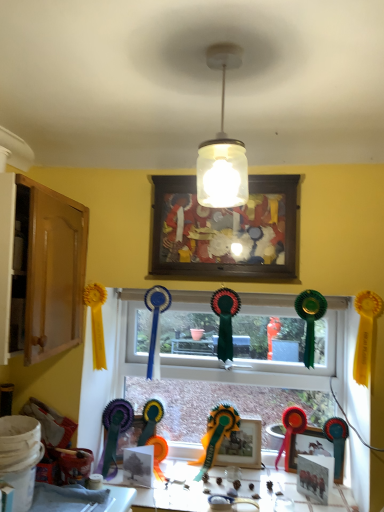
Describe the element at coordinates (242, 445) in the screenshot. I see `wooden photo frame at center, which is the 1th picture frame from back to front` at that location.

Where is `shiny red ribbon at center, which is the 1th toy from right to left`? shiny red ribbon at center, which is the 1th toy from right to left is located at coordinates (291, 430).

What is the approximate width of wooden cabinet at left?

The width of wooden cabinet at left is 15.89 inches.

Locate an element on the screen. The image size is (384, 512). white glossy table at lower center is located at coordinates (173, 490).

What do you see at coordinates (225, 231) in the screenshot? This screenshot has height=512, width=384. I see `wooden picture frame at center, which is the first picture frame from front to back` at bounding box center [225, 231].

What do you see at coordinates (315, 476) in the screenshot?
I see `matte white picture frame at lower center, the fourth picture frame in the top-to-bottom sequence` at bounding box center [315, 476].

How much space does matte white picture frame at lower center, which appears as the 2th picture frame when viewed from the front, occupy vertically?

matte white picture frame at lower center, which appears as the 2th picture frame when viewed from the front, is 6.42 inches tall.

At what (x,y) coordinates should I click in order to perform the action: click on wooden photo frame at center, which is the 1th picture frame from back to front. Please return your answer as a coordinate pair (x, y). Image resolution: width=384 pixels, height=512 pixels. Looking at the image, I should click on (242, 445).

Is translucent glass jar at center positioned far away from wooden photo frame at center, arranged as the second picture frame when viewed from the top?

Yes, translucent glass jar at center is far from wooden photo frame at center, arranged as the second picture frame when viewed from the top.

Can you confirm if translucent glass jar at center is thinner than wooden photo frame at center, arranged as the second picture frame when viewed from the top?

No, translucent glass jar at center is not thinner than wooden photo frame at center, arranged as the second picture frame when viewed from the top.

What's the angular difference between translucent glass jar at center and wooden photo frame at center, which ranks as the 4th picture frame in front-to-back order,'s facing directions?

They differ by 88.9 degrees in their facing directions.

Is translucent glass jar at center at the left side of wooden photo frame at center, which ranks as the 4th picture frame in front-to-back order?

Correct, you'll find translucent glass jar at center to the left of wooden photo frame at center, which ranks as the 4th picture frame in front-to-back order.

In the scene shown: Does wooden cabinet at left contain matte white picture frame at lower center, which appears as the 2th picture frame when viewed from the front?

Definitely not — matte white picture frame at lower center, which appears as the 2th picture frame when viewed from the front, is not inside wooden cabinet at left.

From the image's perspective, who appears lower, wooden cabinet at left or matte white picture frame at lower center, marked as the first picture frame in a bottom-to-top arrangement?

matte white picture frame at lower center, marked as the first picture frame in a bottom-to-top arrangement, appears lower in the image.

There is a matte white picture frame at lower center, which is the third picture frame from back to front. Where is `dresser above it (from a real-world perspective)`? This screenshot has height=512, width=384. dresser above it (from a real-world perspective) is located at coordinates (52, 270).

Is the position of wooden cabinet at left more distant than that of matte white picture frame at lower center, which appears as the 2th picture frame when viewed from the front?

No, wooden cabinet at left is closer to the viewer.

Choose the correct answer: Is translucent glass jar at center inside wooden picture frame at center, marked as the 4th picture frame in a back-to-front arrangement, or outside it?

translucent glass jar at center exists outside the volume of wooden picture frame at center, marked as the 4th picture frame in a back-to-front arrangement.

In terms of width, does translucent glass jar at center look wider or thinner when compared to wooden picture frame at center, marked as the 4th picture frame in a back-to-front arrangement?

translucent glass jar at center is wider than wooden picture frame at center, marked as the 4th picture frame in a back-to-front arrangement.

Based on the photo, is translucent glass jar at center next to wooden picture frame at center, which is the first picture frame from front to back, and touching it?

No, translucent glass jar at center is not making contact with wooden picture frame at center, which is the first picture frame from front to back.

Can you confirm if translucent glass jar at center is taller than wooden picture frame at center, the first picture frame when ordered from top to bottom?

No.

Is the position of glass window at center less distant than that of wooden photo frame at center, which is the 1th picture frame from back to front?

Yes, glass window at center is closer to the viewer.

What are the coordinates of `picture frame that is the 1st one when counting rightward from the glass window at center` in the screenshot? It's located at (242, 445).

Can you tell me how much matte white picture frame at lower center, which is the third picture frame from back to front, and glass window at center differ in facing direction?

matte white picture frame at lower center, which is the third picture frame from back to front, and glass window at center are facing 9.27 degrees away from each other.

Which object is positioned more to the right, matte white picture frame at lower center, which is the third picture frame from back to front, or glass window at center?

matte white picture frame at lower center, which is the third picture frame from back to front.

Is point (312, 456) positioned before point (211, 340)?

Yes, it is.

Considering the positions of point (235, 450) and point (239, 52), is point (235, 450) closer or farther from the camera than point (239, 52)?

Point (235, 450) appears to be farther away from the viewer than point (239, 52).

Is wooden photo frame at center, arranged as the second picture frame when viewed from the top, positioned far away from translucent glass jar at center?

wooden photo frame at center, arranged as the second picture frame when viewed from the top, is far away from translucent glass jar at center.

From the picture: Considering the relative sizes of wooden photo frame at center, which ranks as the 4th picture frame in front-to-back order, and translucent glass jar at center in the image provided, is wooden photo frame at center, which ranks as the 4th picture frame in front-to-back order, shorter than translucent glass jar at center?

Yes, wooden photo frame at center, which ranks as the 4th picture frame in front-to-back order, is shorter than translucent glass jar at center.

Is wooden photo frame at center, which is the 3th picture frame from bottom to top, bigger or smaller than translucent glass jar at center?

Considering their sizes, wooden photo frame at center, which is the 3th picture frame from bottom to top, takes up less space than translucent glass jar at center.

In the image, is wooden photo frame at center, arranged as the second picture frame when viewed from the top, positioned in front of or behind wooden picture frame at center, the 4th picture frame in the bottom-to-top sequence?

wooden photo frame at center, arranged as the second picture frame when viewed from the top, is positioned farther from the viewer than wooden picture frame at center, the 4th picture frame in the bottom-to-top sequence.

Is wooden photo frame at center, arranged as the second picture frame when viewed from the top, spatially inside wooden picture frame at center, the 4th picture frame in the bottom-to-top sequence, or outside of it?

wooden photo frame at center, arranged as the second picture frame when viewed from the top, is not inside wooden picture frame at center, the 4th picture frame in the bottom-to-top sequence, it's outside.

Would you consider wooden photo frame at center, which is the 1th picture frame from back to front, to be distant from wooden picture frame at center, which is the first picture frame from front to back?

Yes, wooden photo frame at center, which is the 1th picture frame from back to front, and wooden picture frame at center, which is the first picture frame from front to back, are quite far apart.

From a real-world perspective, is wooden photo frame at center, which ranks as the 4th picture frame in front-to-back order, above or below wooden picture frame at center, marked as the 4th picture frame in a back-to-front arrangement?

In terms of real-world spatial position, wooden photo frame at center, which ranks as the 4th picture frame in front-to-back order, is below wooden picture frame at center, marked as the 4th picture frame in a back-to-front arrangement.

There is a translucent glass jar at center. What are the coordinates of `the 2nd picture frame below it (from a real-world perspective)` in the screenshot? It's located at (242, 445).

You are a GUI agent. You are given a task and a screenshot of the screen. Output one action in this format:
    pyautogui.click(x=<x>, y=<y>)
    Task: Click on the dresser on the left of matte white picture frame at lower center, which appears as the 2th picture frame when viewed from the front
    
    Given the screenshot: What is the action you would take?
    pyautogui.click(x=52, y=270)

Based on their spatial positions, is shiny red ribbon at center, the second toy from the left, or translucent glass jar at center further from white glossy table at lower center?

translucent glass jar at center.

Looking at the image, which one is located closer to glass window at center, shiny red ribbon at center, the second toy from the left, or translucent glass jar at center?

shiny red ribbon at center, the second toy from the left.

Based on their spatial positions, is translucent glass jar at center or wooden cabinet at left further from wooden photo frame at center, which is the 3th picture frame from bottom to top?

translucent glass jar at center is further to wooden photo frame at center, which is the 3th picture frame from bottom to top.

From the image, which object appears to be farther from white glossy table at lower center, matte plastic picture frame at lower right, which appears as the second picture frame when viewed from the back, or matte white picture frame at lower center, which is the third picture frame from back to front?

Among the two, matte plastic picture frame at lower right, which appears as the second picture frame when viewed from the back, is located further to white glossy table at lower center.

Based on their spatial positions, is matte white picture frame at lower center, which is the third picture frame from back to front, or shiny red ribbon at center, which is the 1th toy from right to left, further from matte green ribbon at center, which is the second toy from right to left?

Based on the image, matte white picture frame at lower center, which is the third picture frame from back to front, appears to be further to matte green ribbon at center, which is the second toy from right to left.

Estimate the real-world distances between objects in this image. Which object is further from shiny red ribbon at center, which is the 1th toy from right to left, translucent glass jar at center or matte white picture frame at lower center, which is the third picture frame from back to front?

Based on the image, translucent glass jar at center appears to be further to shiny red ribbon at center, which is the 1th toy from right to left.

Based on their spatial positions, is matte plastic picture frame at lower right, which is the third picture frame from top to bottom, or matte white picture frame at lower center, which appears as the 2th picture frame when viewed from the front, closer to matte green ribbon at center, which is the 1th toy in left-to-right order?

matte plastic picture frame at lower right, which is the third picture frame from top to bottom, is closer to matte green ribbon at center, which is the 1th toy in left-to-right order.

From the image, which object appears to be nearer to wooden photo frame at center, which is the 1th picture frame from back to front, glass window at center or wooden picture frame at center, the 4th picture frame in the bottom-to-top sequence?

The object closer to wooden photo frame at center, which is the 1th picture frame from back to front, is glass window at center.

Find the location of a particular element. This screenshot has height=512, width=384. picture frame that lies between wooden picture frame at center, marked as the 4th picture frame in a back-to-front arrangement, and matte plastic picture frame at lower right, which appears as the second picture frame when viewed from the back, from top to bottom is located at coordinates (242, 445).

Locate an element on the screen. The width and height of the screenshot is (384, 512). toy situated between wooden photo frame at center, arranged as the second picture frame when viewed from the top, and matte plastic picture frame at lower right, which is the 3th picture frame in front-to-back order, from left to right is located at coordinates (291, 430).

This screenshot has height=512, width=384. Identify the location of window between translucent glass jar at center and white glossy table at lower center in the vertical direction. (247, 342).

Where is `window that lies between wooden picture frame at center, the first picture frame when ordered from top to bottom, and matte green ribbon at center, which is the 1th toy in left-to-right order, from top to bottom`? This screenshot has width=384, height=512. window that lies between wooden picture frame at center, the first picture frame when ordered from top to bottom, and matte green ribbon at center, which is the 1th toy in left-to-right order, from top to bottom is located at coordinates (247, 342).